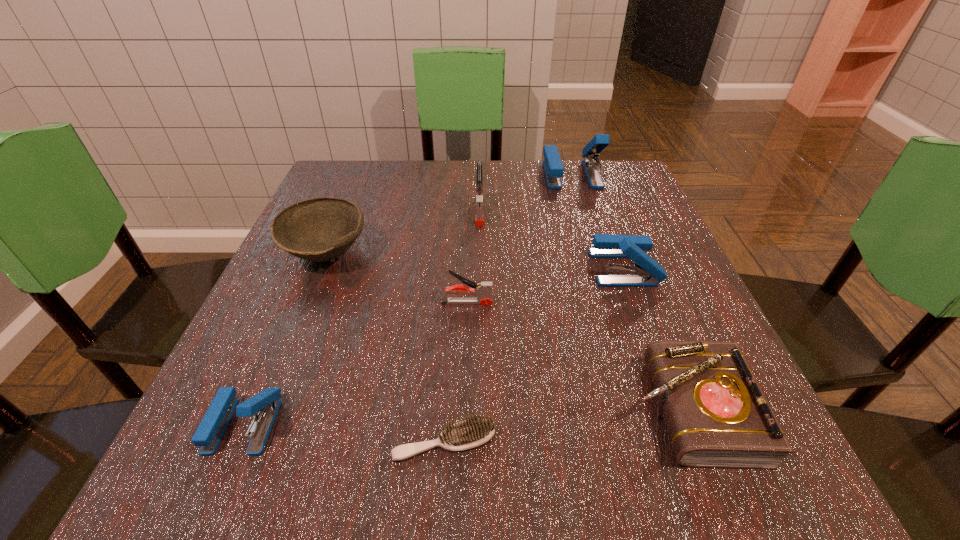
Locate an element on the screen. The height and width of the screenshot is (540, 960). the leftmost blue stapler is located at coordinates (265, 404).

You are a GUI agent. You are given a task and a screenshot of the screen. Output one action in this format:
    pyautogui.click(x=<x>, y=<y>)
    Task: Click on the second shortest object
    
    Given the screenshot: What is the action you would take?
    pyautogui.click(x=717, y=416)

Find the location of `scrubbing brush`. scrubbing brush is located at coordinates (475, 431).

Identify the location of vacant region located 0.270m on the front of the biggest blue stapler. The image size is (960, 540). click(599, 262).

The width and height of the screenshot is (960, 540). I want to click on vacant space located 0.220m on the handle side of the seventh nearest object, so click(x=480, y=298).

The height and width of the screenshot is (540, 960). Find the location of `vacant space located on the back of the second biggest blue stapler`. vacant space located on the back of the second biggest blue stapler is located at coordinates (586, 164).

Find the location of a particular element. free space located on the back of the bowl is located at coordinates (360, 171).

Image resolution: width=960 pixels, height=540 pixels. I want to click on vacant region located 0.130m on the handle side of the smaller gray stapler, so click(565, 302).

Identify the location of free location located on the back of the leftmost blue stapler. (319, 252).

This screenshot has height=540, width=960. I want to click on blank space located on the back of the seventh tallest object, so click(x=618, y=233).